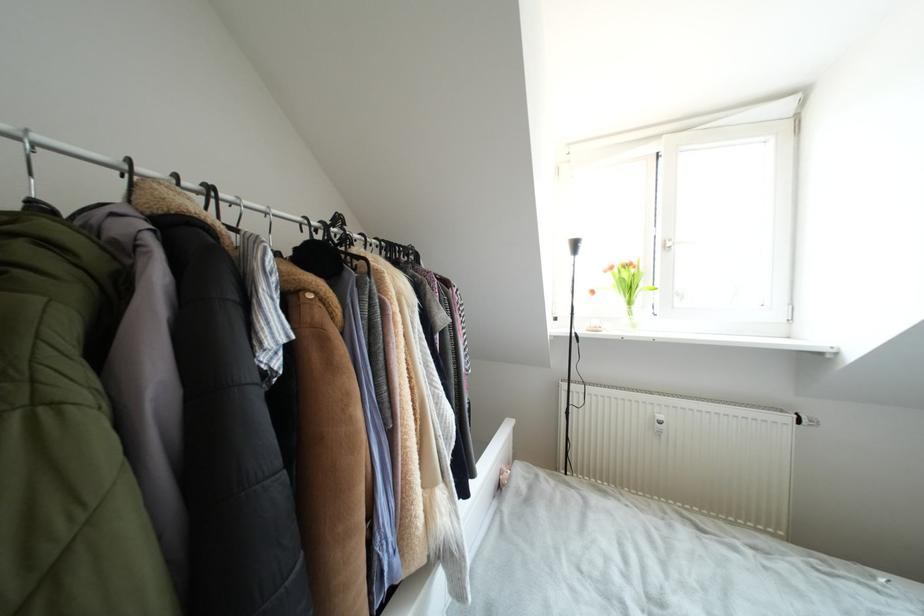
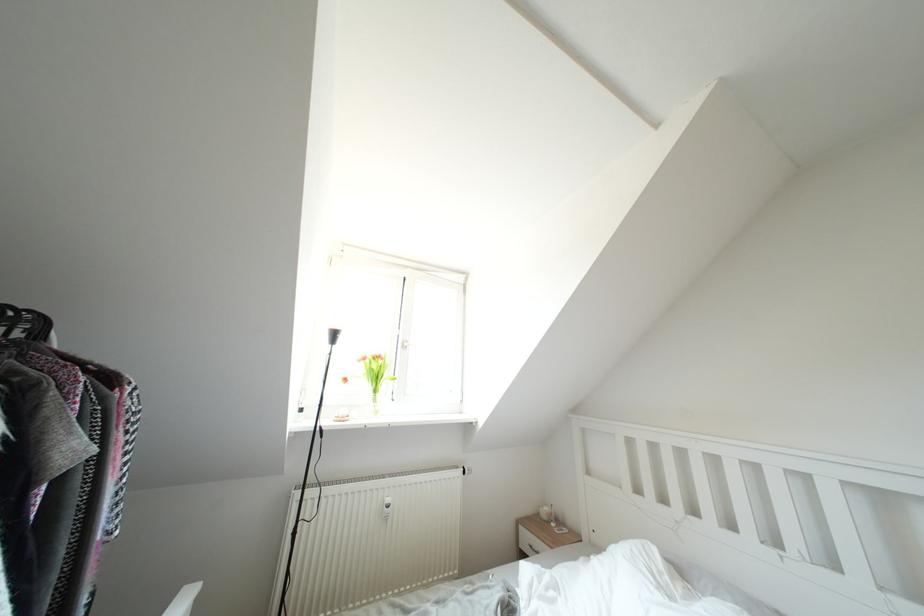
How did the camera likely rotate?

The camera's rotation is toward right-up.